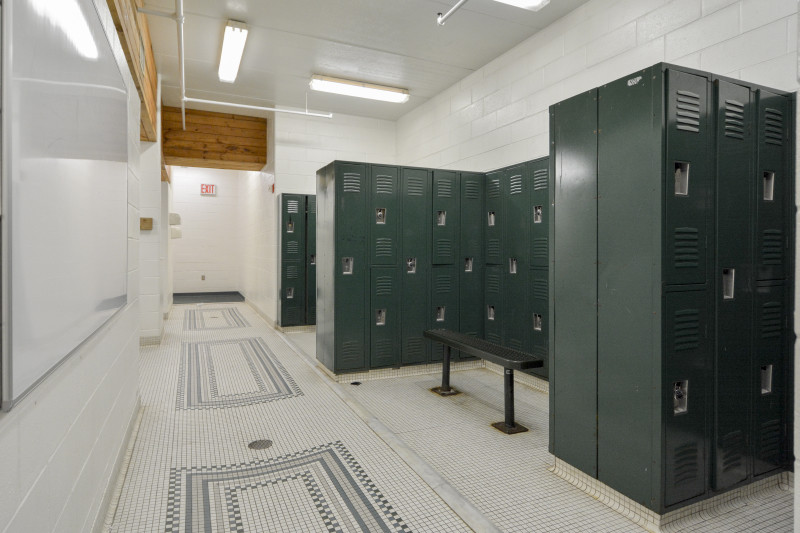
This screenshot has height=533, width=800. In order to click on exit sign in this screenshot , I will do `click(210, 195)`.